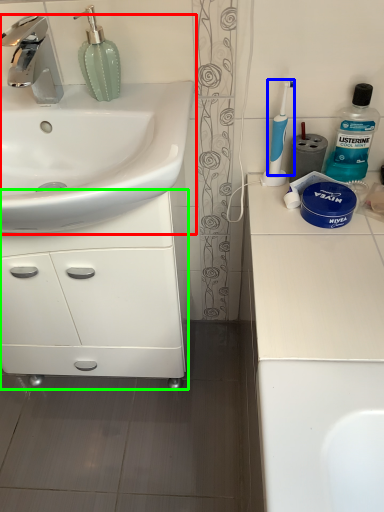
Question: Which is nearer to the sink (highlighted by a red box)? toothbrush (highlighted by a blue box) or bathroom cabinet (highlighted by a green box).

Choices:
 (A) toothbrush
 (B) bathroom cabinet

Answer: (B)